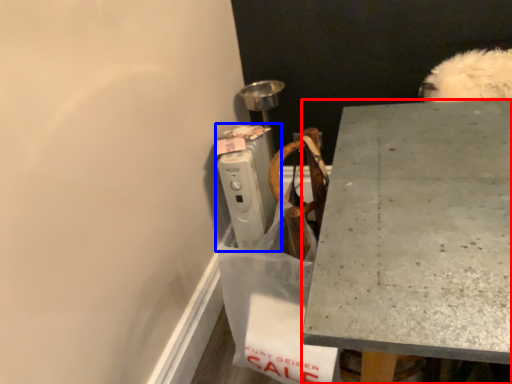
Question: Which point is closer to the camera, desk (highlighted by a red box) or radiator (highlighted by a blue box)?

Choices:
 (A) desk
 (B) radiator

Answer: (A)